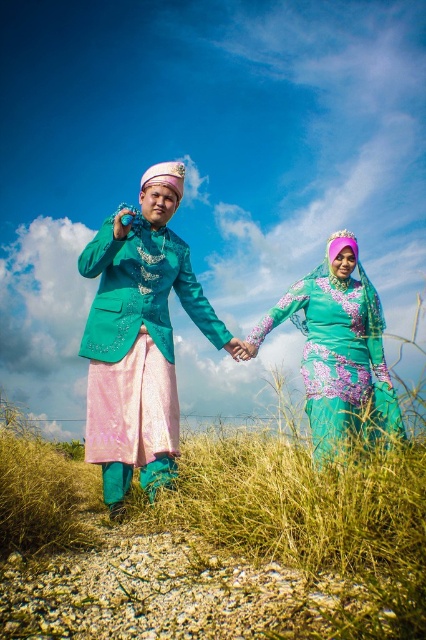
Measure the distance between point (98, 248) and camera.

Point (98, 248) and camera are 4.89 meters apart.

Is satin teal dress at center wider than teal floral dress at center?

Correct, the width of satin teal dress at center exceeds that of teal floral dress at center.

Locate an element on the screen. satin teal dress at center is located at coordinates (141, 337).

Identify the location of satin teal dress at center. The width and height of the screenshot is (426, 640). (141, 337).